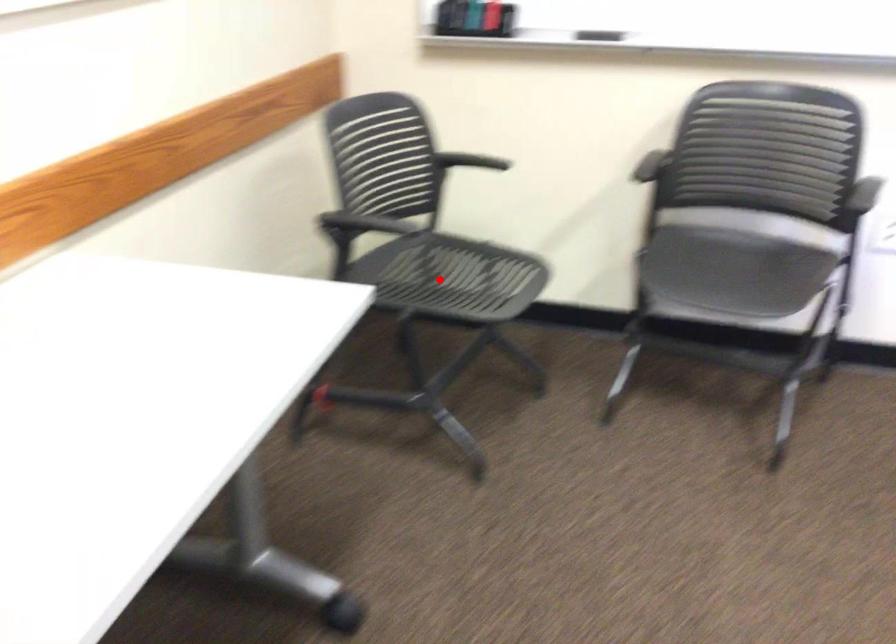
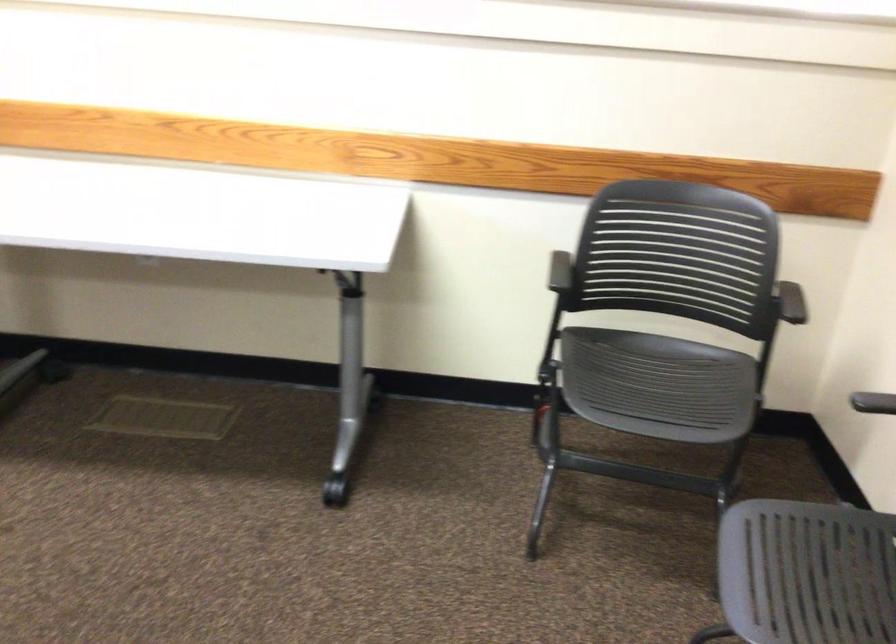
The point at the highlighted location is marked in the first image. Where is the corresponding point in the second image?

(658, 384)